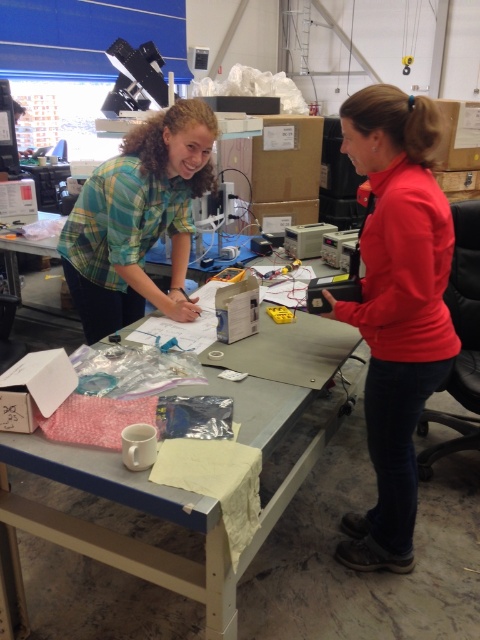
Question: Can you confirm if red matte shirt at right is positioned below metallic gray table at center?

Choices:
 (A) yes
 (B) no

Answer: (B)

Question: Is metallic gray table at center further to the viewer compared to green plaid shirt at upper left?

Choices:
 (A) no
 (B) yes

Answer: (A)

Question: Which point is farther to the camera?

Choices:
 (A) (224, 616)
 (B) (116, 292)

Answer: (B)

Question: Which object is closer to the camera taking this photo?

Choices:
 (A) red matte shirt at right
 (B) green plaid shirt at upper left
 (C) metallic gray table at center

Answer: (C)

Question: Is red matte shirt at right smaller than metallic gray table at center?

Choices:
 (A) no
 (B) yes

Answer: (B)

Question: Which object is positioned closest to the red matte shirt at right?

Choices:
 (A) metallic gray table at center
 (B) green plaid shirt at upper left

Answer: (A)